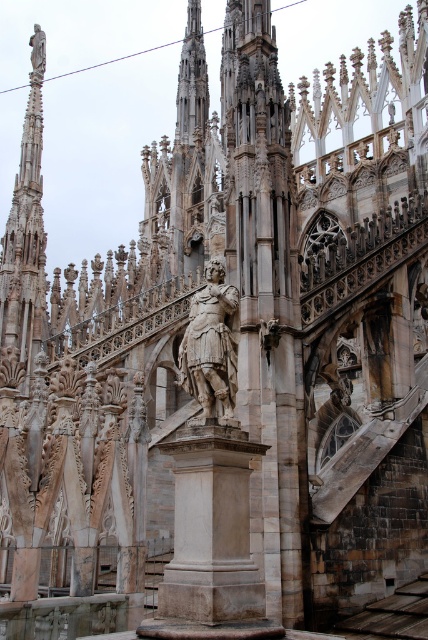
Locate an element on the screen. Image resolution: width=428 pixels, height=640 pixels. polished stone spire at upper left is located at coordinates (26, 230).

Is polished stone spire at upper left above polished bronze statue at center?

Indeed, polished stone spire at upper left is positioned over polished bronze statue at center.

Is point (29, 100) positioned behind point (214, 291)?

Yes, it is behind point (214, 291).

You are a GUI agent. You are given a task and a screenshot of the screen. Output one action in this format:
    pyautogui.click(x=<x>, y=<y>)
    Task: Click on the polished stone spire at upper left
    This screenshot has height=640, width=428.
    Given the screenshot: What is the action you would take?
    pyautogui.click(x=26, y=230)